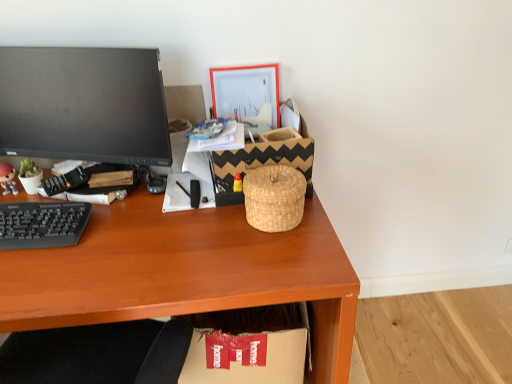
I want to click on black plastic keyboard at left, so click(x=42, y=224).

The height and width of the screenshot is (384, 512). What do you see at coordinates (42, 224) in the screenshot?
I see `black plastic keyboard at left` at bounding box center [42, 224].

Locate an element on the screen. cardboard box at lower center is located at coordinates (248, 346).

I want to click on woven natural basket at center, so click(274, 198).

The height and width of the screenshot is (384, 512). What do you see at coordinates (274, 198) in the screenshot? I see `woven natural basket at center` at bounding box center [274, 198].

Locate an element on the screen. This screenshot has height=384, width=512. wooden desk at center is located at coordinates (186, 273).

From a real-world perspective, which object rests below the other?

In real-world perspective, woven natural basket at center is lower.

Between woven natural basket at center and matte plastic picture frame at upper center, which one is positioned in front?

woven natural basket at center is closer to the camera.

Choose the correct answer: Is woven natural basket at center inside matte plastic picture frame at upper center or outside it?

woven natural basket at center lies outside matte plastic picture frame at upper center.

Is wooden desk at center at the right side of matte plastic picture frame at upper center?

No, wooden desk at center is not to the right of matte plastic picture frame at upper center.

Consider the image. Between wooden desk at center and matte plastic picture frame at upper center, which one has smaller width?

Thinner between the two is matte plastic picture frame at upper center.

I want to click on desk that is below the matte plastic picture frame at upper center (from the image's perspective), so click(186, 273).

Does wooden desk at center come behind matte plastic picture frame at upper center?

That is False.

Which is further, (227, 89) or (60, 235)?

The point (227, 89) is farther from the camera.

From a real-world perspective, is matte plastic picture frame at upper center physically located above or below black plastic keyboard at left?

matte plastic picture frame at upper center is above black plastic keyboard at left.

Does matte plastic picture frame at upper center come in front of black plastic keyboard at left?

No.

The width and height of the screenshot is (512, 384). Find the location of `picture frame to the right of black plastic keyboard at left`. picture frame to the right of black plastic keyboard at left is located at coordinates (246, 93).

From the image's perspective, which one is positioned higher, black plastic keyboard at left or cardboard box at lower center?

black plastic keyboard at left appears higher in the image.

From a real-world perspective, which is physically below, black plastic keyboard at left or cardboard box at lower center?

cardboard box at lower center is physically lower.

In the scene shown: Is black plastic keyboard at left taller or shorter than cardboard box at lower center?

Clearly, black plastic keyboard at left is shorter compared to cardboard box at lower center.

Is black plastic keyboard at left positioned far away from cardboard box at lower center?

No, black plastic keyboard at left is not far from cardboard box at lower center.

From a real-world perspective, is cardboard box at lower center physically located above or below matte plastic figurine at left?

Clearly, from a real-world perspective, cardboard box at lower center is below matte plastic figurine at left.

The image size is (512, 384). What are the coordinates of `cardboard box below the matte plastic figurine at left (from the image's perspective)` in the screenshot? It's located at (248, 346).

In the scene shown: Is cardboard box at lower center to the left of matte plastic figurine at left from the viewer's perspective?

In fact, cardboard box at lower center is to the right of matte plastic figurine at left.

Based on the photo, is cardboard box at lower center not close to matte plastic figurine at left?

No, cardboard box at lower center is not far from matte plastic figurine at left.

Which object is positioned more to the right, wooden desk at center or matte plastic figurine at left?

From the viewer's perspective, wooden desk at center appears more on the right side.

Considering the positions of points (34, 322) and (9, 172), is point (34, 322) farther from camera compared to point (9, 172)?

That is False.

From the image's perspective, is wooden desk at center on matte plastic figurine at left?

Incorrect, from the image's perspective, wooden desk at center is lower than matte plastic figurine at left.

Is wooden desk at center not close to matte plastic figurine at left?

They are positioned close to each other.

Between cardboard box at lower center and black plastic keyboard at left, which one has larger size?

cardboard box at lower center is bigger.

Are cardboard box at lower center and black plastic keyboard at left beside each other?

No, cardboard box at lower center is not with black plastic keyboard at left.

From a real-world perspective, is cardboard box at lower center above or below black plastic keyboard at left?

From a real-world perspective, cardboard box at lower center is physically below black plastic keyboard at left.

Which is farther from the camera, (290,359) or (24,204)?

The point (290,359) is farther from the camera.

I want to click on basket that appears below the matte plastic picture frame at upper center (from the image's perspective), so click(x=274, y=198).

Identify the location of desk on the left of matte plastic picture frame at upper center. (186, 273).

Estimate the real-world distances between objects in this image. Which object is further from matte plastic figurine at left, black matte computer monitor at left or woven natural basket at center?

The object further to matte plastic figurine at left is woven natural basket at center.

From the image, which object appears to be farther from black plastic keyboard at left, black matte computer monitor at left or woven natural basket at center?

woven natural basket at center is positioned further to the anchor black plastic keyboard at left.

When comparing their distances from matte plastic picture frame at upper center, does cardboard box at lower center or black matte computer monitor at left seem further?

Based on the image, cardboard box at lower center appears to be further to matte plastic picture frame at upper center.

Looking at the image, which one is located closer to black matte computer monitor at left, wooden desk at center or matte plastic picture frame at upper center?

Among the two, wooden desk at center is located nearer to black matte computer monitor at left.

Consider the image. Estimate the real-world distances between objects in this image. Which object is closer to matte plastic figurine at left, woven natural basket at center or cardboard box at lower center?

woven natural basket at center is closer to matte plastic figurine at left.

When comparing their distances from woven natural basket at center, does matte plastic picture frame at upper center or wooden desk at center seem closer?

wooden desk at center lies closer to woven natural basket at center than the other object.

Estimate the real-world distances between objects in this image. Which object is closer to wooden desk at center, matte plastic figurine at left or matte plastic picture frame at upper center?

Among the two, matte plastic picture frame at upper center is located nearer to wooden desk at center.

From the image, which object appears to be nearer to black plastic keyboard at left, wooden desk at center or woven natural basket at center?

wooden desk at center lies closer to black plastic keyboard at left than the other object.

I want to click on desk that lies between woven natural basket at center and cardboard box at lower center from top to bottom, so click(x=186, y=273).

Find the location of a particular element. Image resolution: width=512 pixels, height=384 pixels. picture frame between matte plastic figurine at left and woven natural basket at center in the horizontal direction is located at coordinates (246, 93).

Locate an element on the screen. This screenshot has width=512, height=384. computer monitor located between black plastic keyboard at left and matte plastic picture frame at upper center in the left-right direction is located at coordinates (83, 105).

This screenshot has width=512, height=384. In order to click on toy between black matte computer monitor at left and cardboard box at lower center in the up-down direction in this screenshot , I will do `click(7, 178)`.